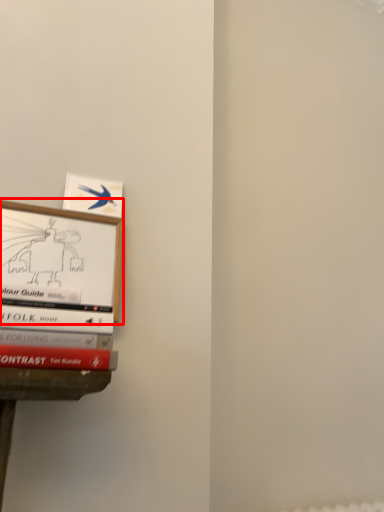
Question: Where is picture frame (annotated by the red box) located in relation to book in the image?

Choices:
 (A) right
 (B) left

Answer: (B)